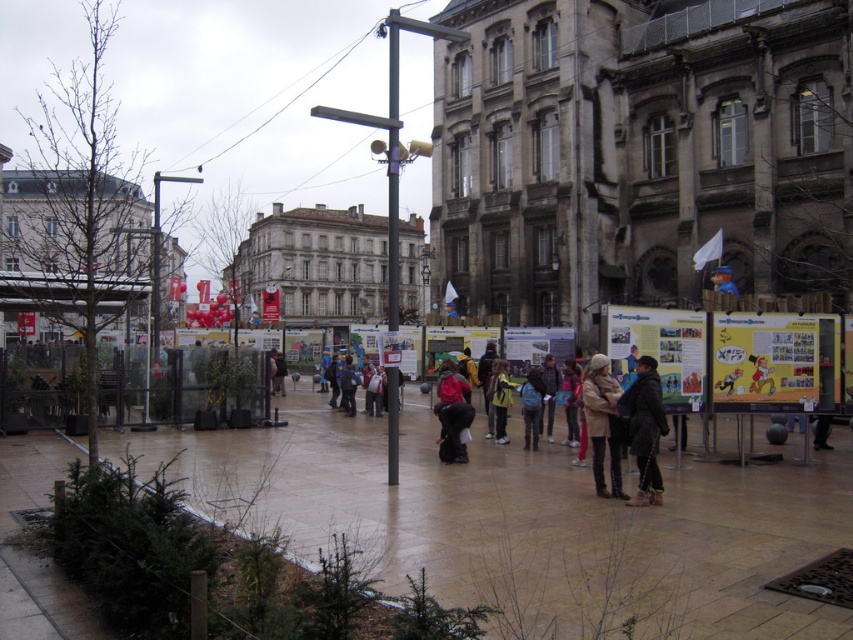
Question: In this image, where is brown stone pavement at lower center located relative to yellow jacket at center?

Choices:
 (A) right
 (B) left

Answer: (B)

Question: Can you confirm if matte black jacket at center is positioned below blue fabric backpack at center?

Choices:
 (A) no
 (B) yes

Answer: (A)

Question: Among these points, which one is nearest to the camera?

Choices:
 (A) (447, 451)
 (B) (495, 368)

Answer: (A)

Question: Which object appears closest to the camera in this image?

Choices:
 (A) yellow jacket at center
 (B) tan leather jacket at center

Answer: (B)

Question: In this image, where is brown stone pavement at lower center located relative to yellow jacket at center?

Choices:
 (A) above
 (B) below

Answer: (B)

Question: Which object is farther from the camera taking this photo?

Choices:
 (A) blue fabric backpack at center
 (B) brown stone pavement at lower center

Answer: (A)